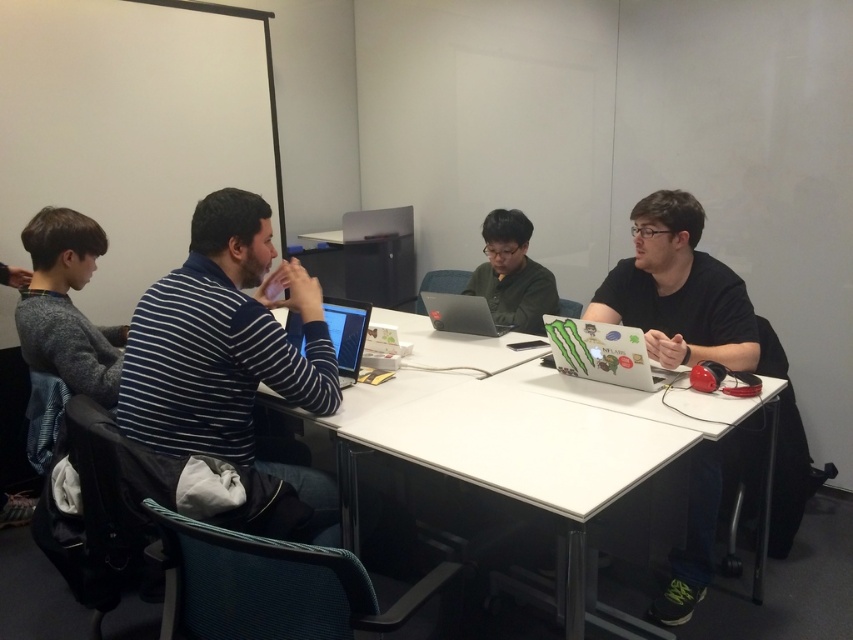
Question: Is white glossy table at center to the right of green matte sweater at center from the viewer's perspective?

Choices:
 (A) no
 (B) yes

Answer: (A)

Question: Which of the following is the closest to the observer?

Choices:
 (A) (340, 300)
 (B) (550, 500)

Answer: (B)

Question: Does green matte sweater at center have a lesser width compared to matte black laptop at center?

Choices:
 (A) yes
 (B) no

Answer: (B)

Question: Which is nearer to the blue striped sweater at center?

Choices:
 (A) white glossy table at center
 (B) shiny black laptop at center
 (C) matte black laptop at center
 (D) gray sweater at left

Answer: (B)

Question: Which point is farther from the camera taking this photo?

Choices:
 (A) (291, 285)
 (B) (381, 216)

Answer: (B)

Question: Can you confirm if black matte shirt at right is positioned to the right of matte green laptop at right?

Choices:
 (A) no
 (B) yes

Answer: (B)